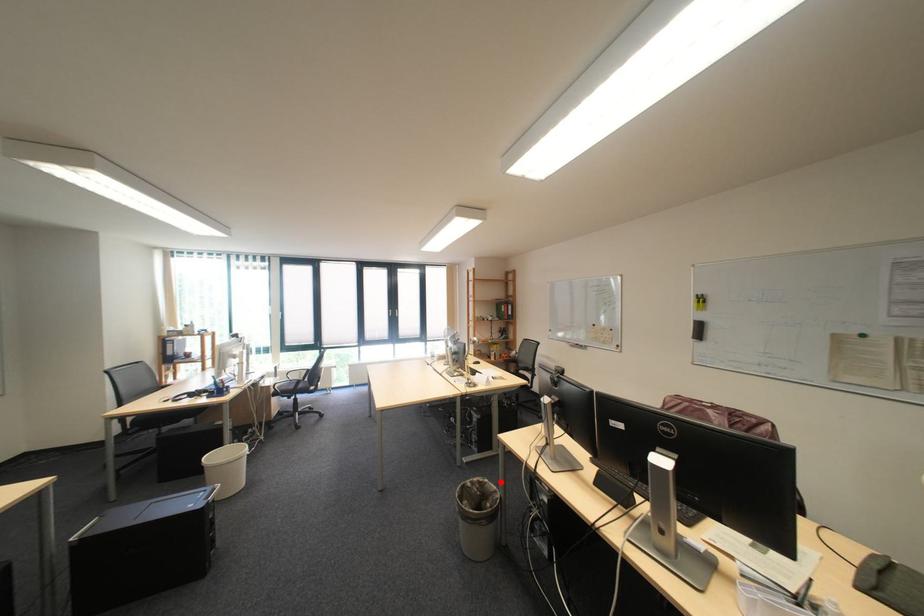
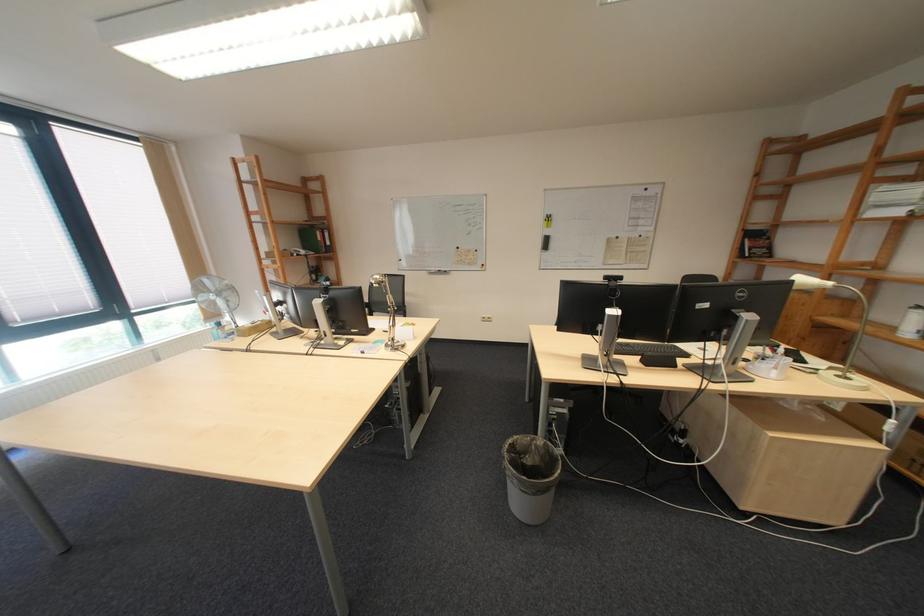
Question: I am providing you with two images of the same scene from different viewpoints. Given a red point in image1, look at the same physical point in image2. Is it:

Choices:
 (A) Closer to the viewpoint
 (B) Farther from the viewpoint

Answer: (A)